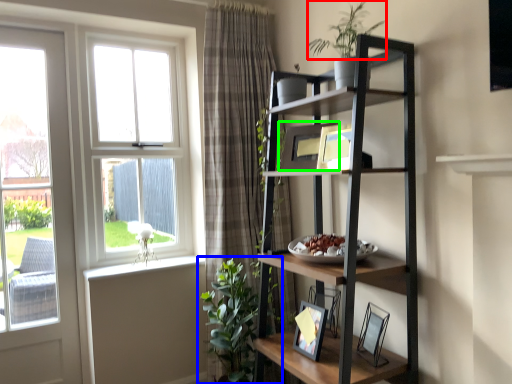
Question: Based on their relative distances, which object is farther from vegetation (highlighted by a red box)? Choose from houseplant (highlighted by a blue box) and picture frame (highlighted by a green box).

Choices:
 (A) houseplant
 (B) picture frame

Answer: (A)